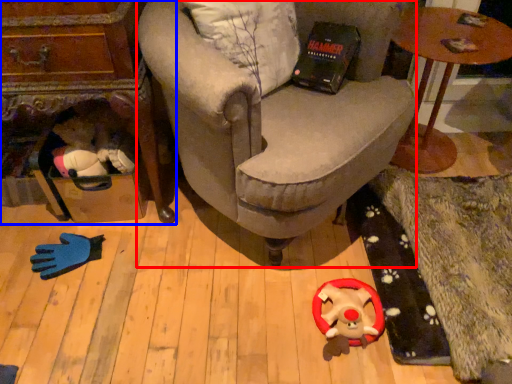
Question: Among these objects, which one is farthest to the camera, chair (highlighted by a red box) or table (highlighted by a blue box)?

Choices:
 (A) chair
 (B) table

Answer: (B)